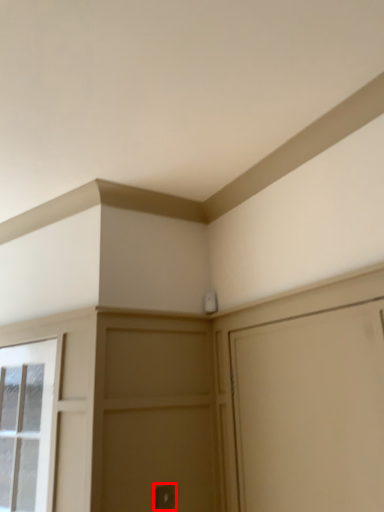
Question: Considering the relative positions of door handle (annotated by the red box) and window in the image provided, where is door handle (annotated by the red box) located with respect to the staircase?

Choices:
 (A) right
 (B) left

Answer: (A)